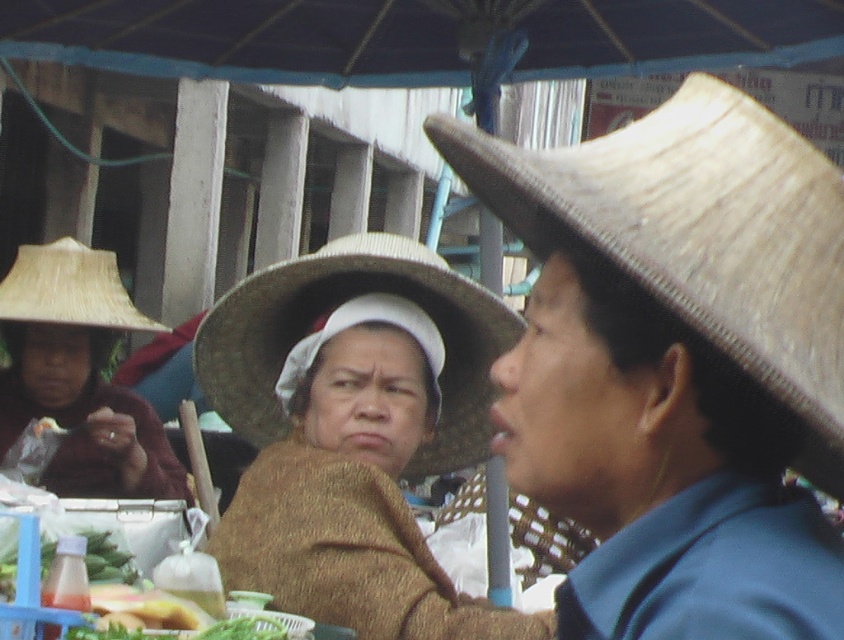
Which is above, brown woven hat at center or brown straw hat at center?

brown straw hat at center

Does point (234, 563) come behind point (428, 451)?

No, it is in front of (428, 451).

This screenshot has height=640, width=844. What are the coordinates of `brown woven hat at center` in the screenshot? It's located at (355, 486).

Does matte brown hat at left lie in front of natural straw hat at left?

Yes, matte brown hat at left is in front of natural straw hat at left.

Is matte brown hat at left below natural straw hat at left?

Correct, matte brown hat at left is located below natural straw hat at left.

Identify the location of matte brown hat at left. (79, 374).

Is point (621, 170) positioned after point (235, 342)?

No.

Is bleached straw hat at center wider than brown straw hat at center?

No.

In order to click on bleached straw hat at center in this screenshot , I will do `click(701, 234)`.

I want to click on bleached straw hat at center, so click(701, 234).